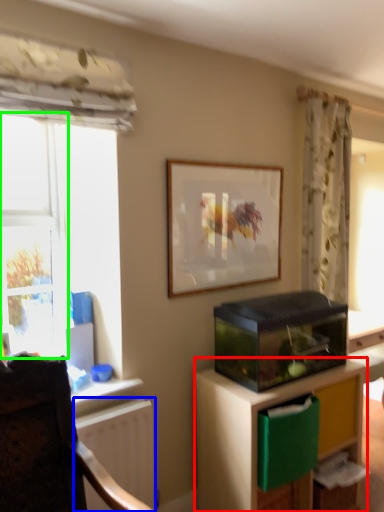
Question: Which object is positioned farthest from cabinetry (highlighted by a red box)? Select from radiator (highlighted by a blue box) and window (highlighted by a green box).

Choices:
 (A) radiator
 (B) window

Answer: (B)